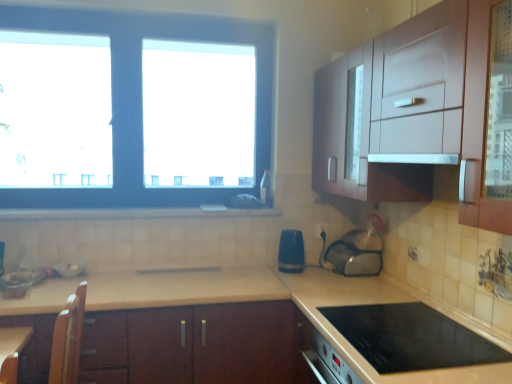
At what (x,y) coordinates should I click in order to perform the action: click on vacant area that is in front of blue plastic toaster at center, which is the 2th appliance from right to left. Please return your answer as a coordinate pair (x, y). The height and width of the screenshot is (384, 512). Looking at the image, I should click on (300, 279).